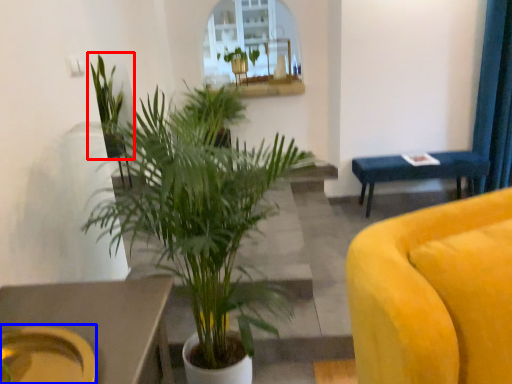
Question: Which object appears farthest to the camera in this image, houseplant (highlighted by a red box) or platter (highlighted by a blue box)?

Choices:
 (A) houseplant
 (B) platter

Answer: (A)